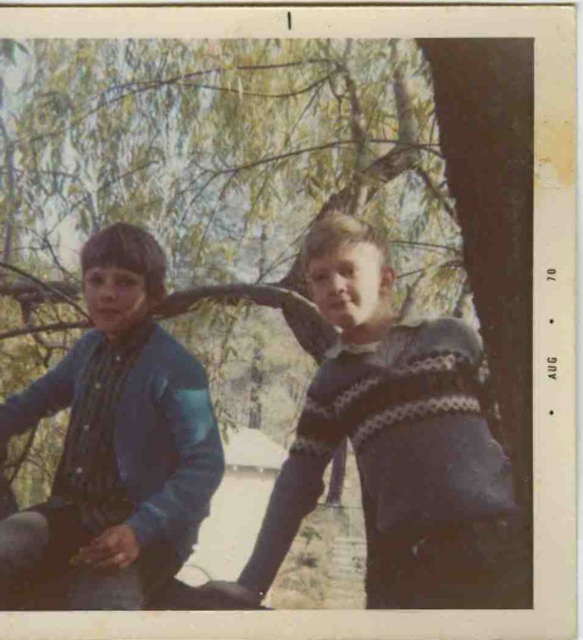
Question: Does green leafy tree at upper center have a lesser width compared to blue denim jacket at left?

Choices:
 (A) yes
 (B) no

Answer: (B)

Question: Can you confirm if green leafy tree at upper center is positioned to the left of blue denim jacket at left?

Choices:
 (A) no
 (B) yes

Answer: (A)

Question: Does green leafy tree at upper center appear on the right side of knitted sweater at center?

Choices:
 (A) yes
 (B) no

Answer: (B)

Question: Which of the following is the closest to the observer?

Choices:
 (A) (1, 602)
 (B) (458, 484)

Answer: (A)

Question: Which point is farther to the camera?

Choices:
 (A) knitted sweater at center
 (B) blue denim jacket at left
 (C) green leafy tree at upper center

Answer: (C)

Question: Among these objects, which one is farthest from the camera?

Choices:
 (A) green leafy tree at upper center
 (B) blue denim jacket at left
 (C) knitted sweater at center

Answer: (A)